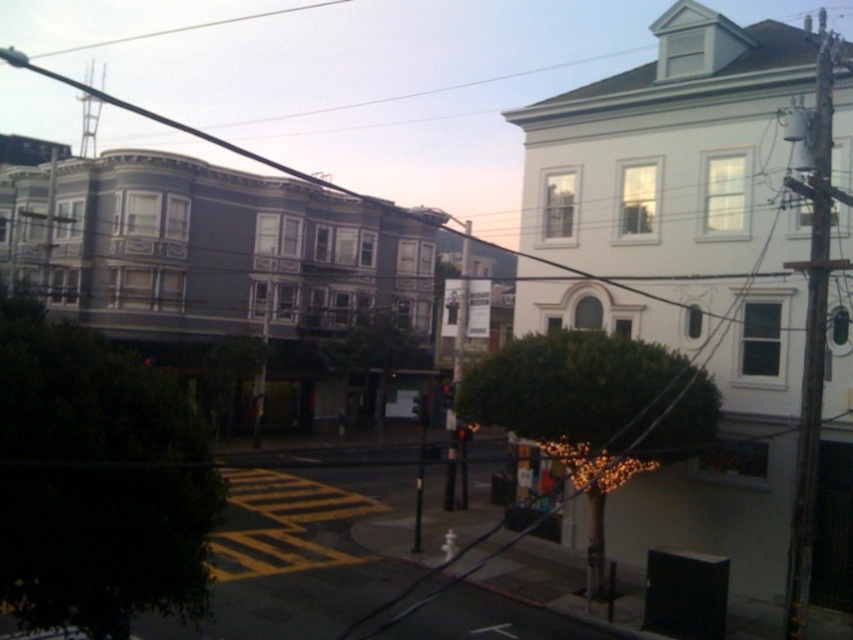
You are a city planner evaluating the street layout. The metallic pole at center and the red glass traffic light at center are both in the same location. Which one would block more sunlight for pedestrians walking along the sidewalk?

The metallic pole at center is bigger than the red glass traffic light at center, so it would block more sunlight for pedestrians walking along the sidewalk.

You are a delivery drone operator. Your drone is currently at the point marked by point (190, 28). You need to deliver a package to a location on the right side of the image. Which direction should you fly to reach the destination?

The point marked by point (190, 28) is at the white wire at upper center. To reach the right side of the image, you should fly towards the right direction from the white wire at upper center.